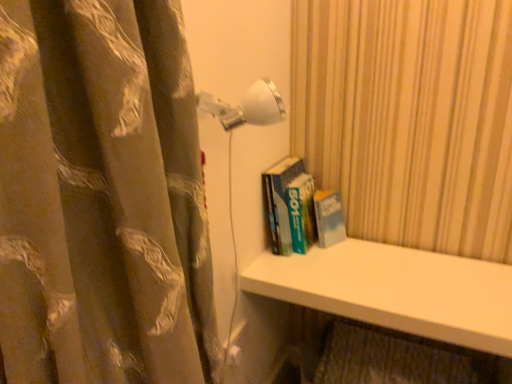
Question: Is white smooth shelf at lower center inside the boundaries of brown floral fabric curtain at left, or outside?

Choices:
 (A) outside
 (B) inside

Answer: (A)

Question: Considering the positions of white smooth shelf at lower center and brown floral fabric curtain at left in the image, is white smooth shelf at lower center taller or shorter than brown floral fabric curtain at left?

Choices:
 (A) short
 (B) tall

Answer: (A)

Question: Which object is the closest to the white smooth shelf at lower center?

Choices:
 (A) white glossy wall lamp at upper center
 (B) brown floral fabric curtain at left
 (C) hardcover book at center

Answer: (C)

Question: Which is farther from the white glossy wall lamp at upper center?

Choices:
 (A) hardcover book at center
 (B) brown floral fabric curtain at left
 (C) white smooth shelf at lower center

Answer: (C)